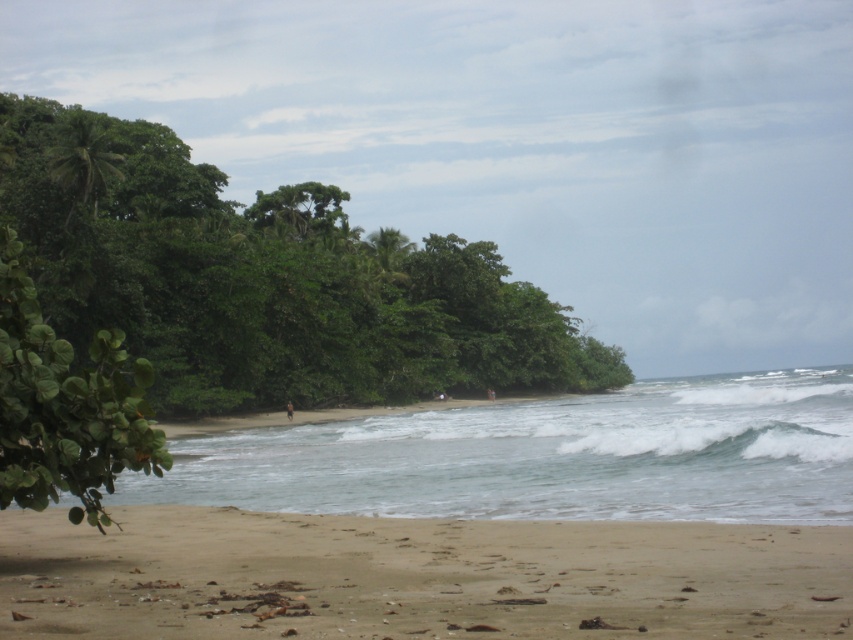
You are standing on the beach and want to locate two specific points marked in the image. The first point is at coordinates point (198, 193) and the second is at point (456, 554). Which of these points is closer to the ocean waves in the middle ground?

Point (456, 554) is closer to the ocean waves in the middle ground because it is in front of point (198, 193).

You are standing on the beach and want to take a photo of the green leafy trees at left. If your camera has a maximum zoom range of 50 meters, will you be able to capture the trees clearly in your photo?

The green leafy trees at left is 54.81 meters away from viewer. Since the camera can only zoom up to 50 meters, you won not be able to capture the trees clearly.